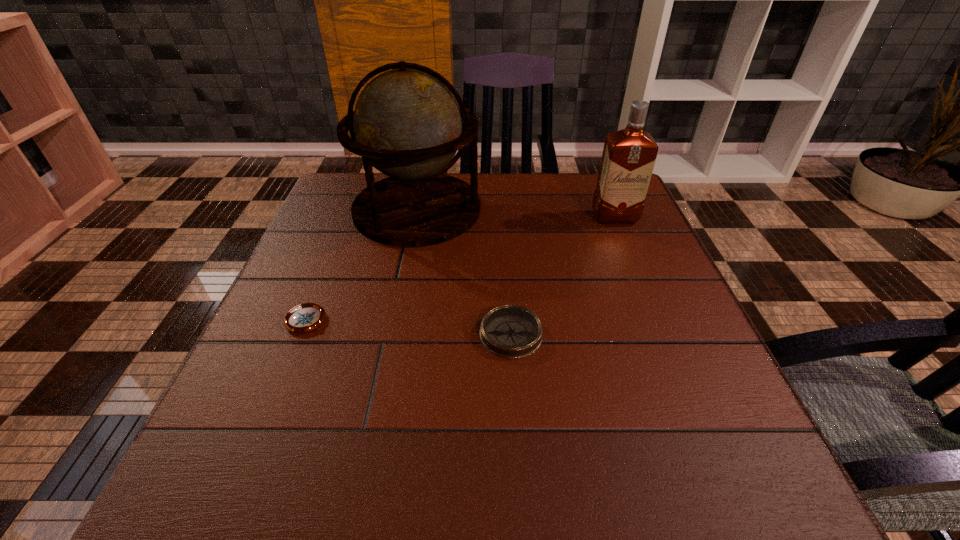
In order to click on empty space between the right compass and the rightmost object in this screenshot , I will do `click(563, 276)`.

At what (x,y) coordinates should I click in order to perform the action: click on empty location between the shorter compass and the third tallest object. Please return your answer as a coordinate pair (x, y). The width and height of the screenshot is (960, 540). Looking at the image, I should click on (409, 327).

Find the location of a particular element. This screenshot has height=540, width=960. object that is the closest to the left compass is located at coordinates [x=407, y=124].

Identify the location of the closest object to the shortest object. (407, 124).

Locate an element on the screen. The width and height of the screenshot is (960, 540). vacant space that satisfies the following two spatial constraints: 1. on the front side of the left compass; 2. on the left side of the third tallest object is located at coordinates pyautogui.click(x=301, y=334).

Where is `free region that satisfies the following two spatial constraints: 1. on the front side of the shorter compass; 2. on the left side of the second shortest object`? The height and width of the screenshot is (540, 960). free region that satisfies the following two spatial constraints: 1. on the front side of the shorter compass; 2. on the left side of the second shortest object is located at coordinates (301, 334).

What are the coordinates of `vacant space that satisfies the following two spatial constraints: 1. on the front-facing side of the taller compass; 2. on the right side of the globe` in the screenshot? It's located at (393, 334).

Locate an element on the screen. The image size is (960, 540). free location that satisfies the following two spatial constraints: 1. on the front side of the third tallest object; 2. on the left side of the shortest object is located at coordinates (301, 334).

At what (x,y) coordinates should I click in order to perform the action: click on vacant region that satisfies the following two spatial constraints: 1. on the front-facing side of the tallest object; 2. on the back side of the third tallest object. Please return your answer as a coordinate pair (x, y). Looking at the image, I should click on (393, 334).